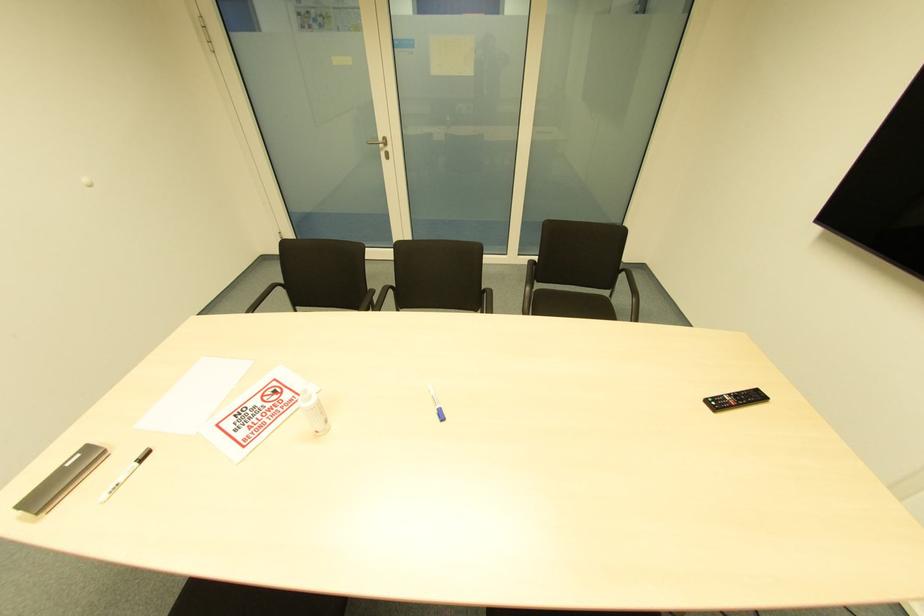
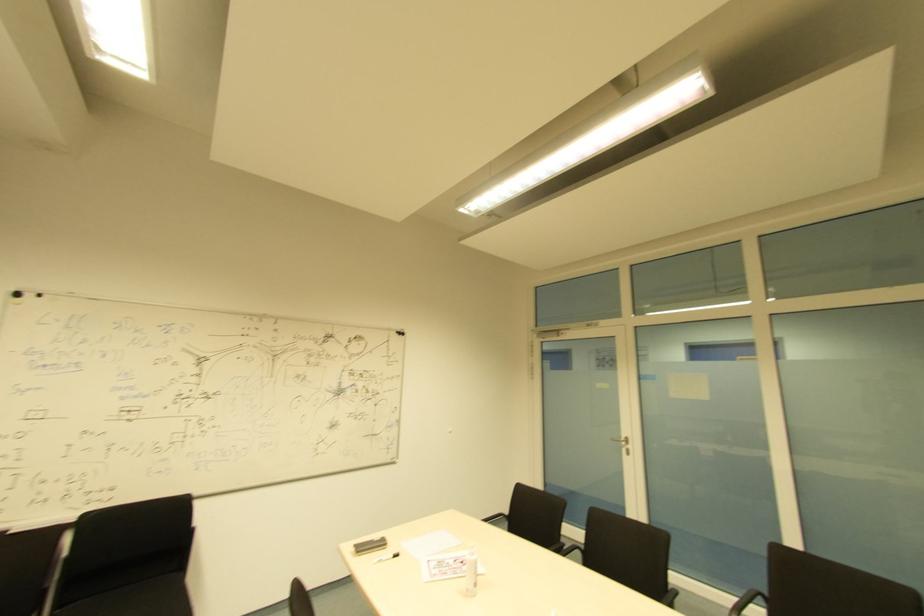
Locate, in the second image, the point that corresponds to [252,423] in the first image.

(444, 572)